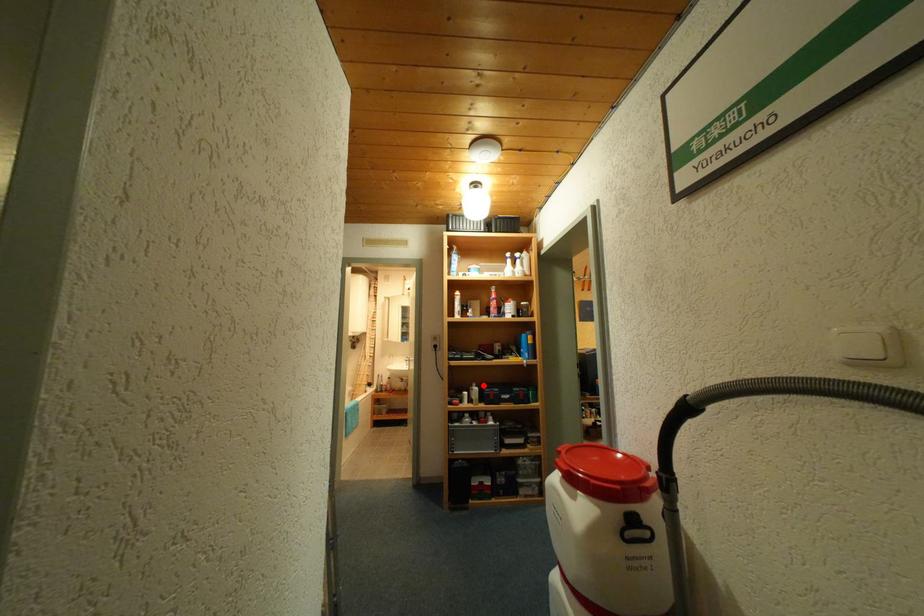
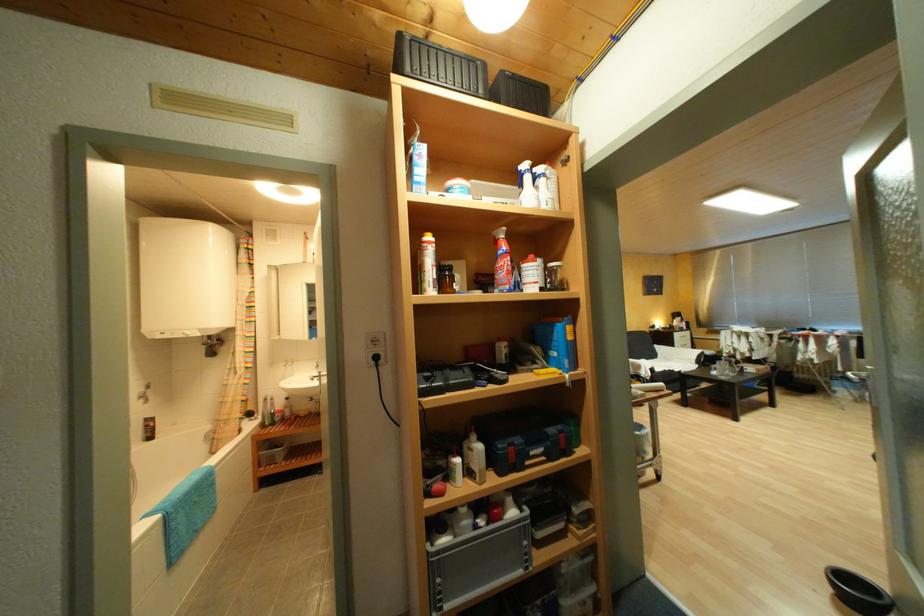
Where in the second image is the point corresponding to the highlighted location from the first image?

(482, 438)